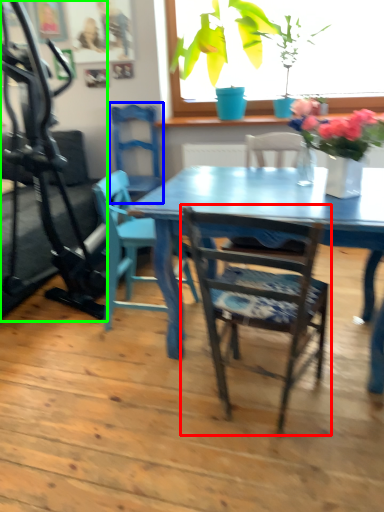
Question: Which object is positioned farthest from chair (highlighted by a red box)? Select from chair (highlighted by a blue box) and treadmill (highlighted by a green box).

Choices:
 (A) chair
 (B) treadmill

Answer: (A)